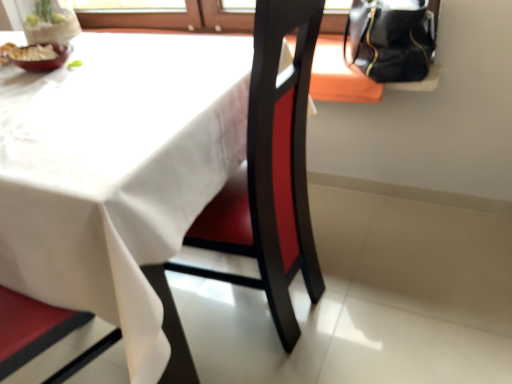
I want to click on unoccupied region to the right of matte ceramic bowl at upper left, so click(95, 60).